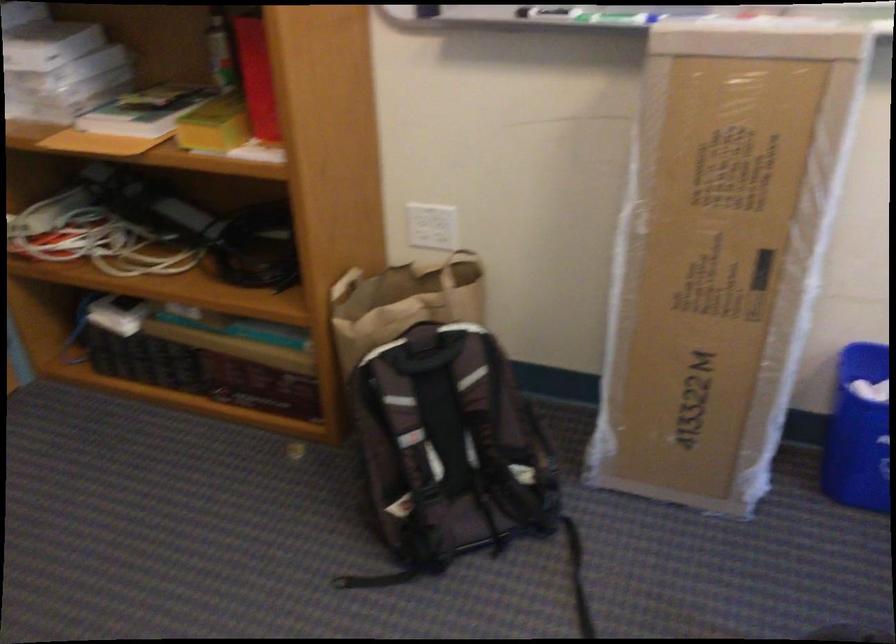
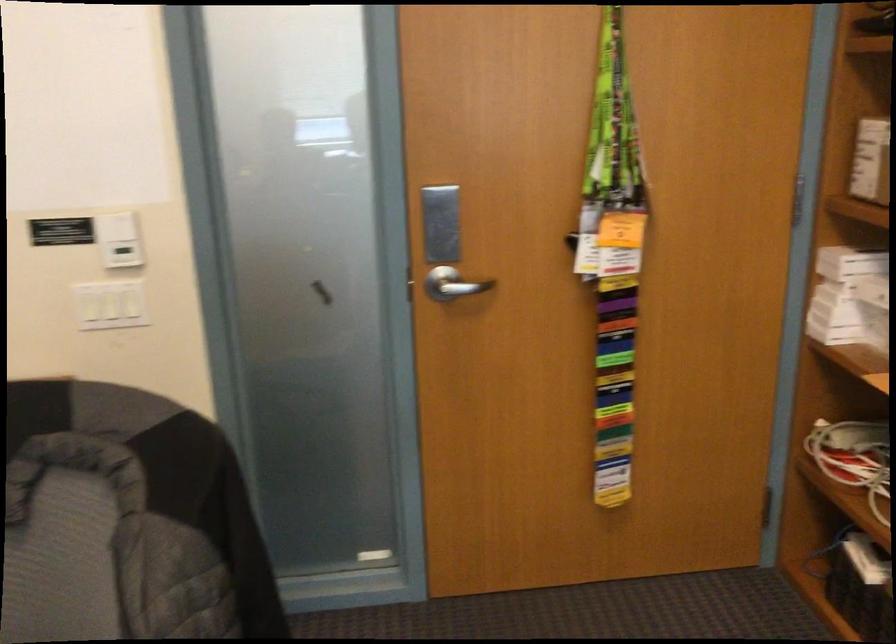
Question: Based on the continuous images, in which direction is the camera rotating? Reply with the corresponding letter.

Choices:
 (A) Left
 (B) Right
 (C) Up
 (D) Down

Answer: (A)